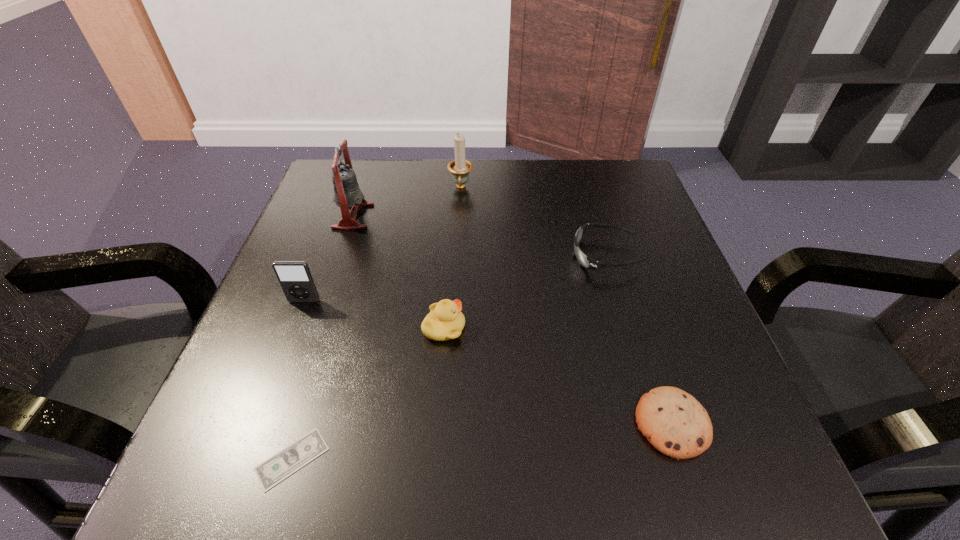
This screenshot has height=540, width=960. I want to click on the tallest object, so [x=347, y=193].

Identify the location of bell. (347, 193).

Locate an element on the screen. Image resolution: width=960 pixels, height=540 pixels. the farthest object is located at coordinates (460, 168).

In order to click on candle_holder in this screenshot , I will do `click(460, 168)`.

Identify the location of iPod. (296, 281).

This screenshot has height=540, width=960. Find the location of `the third tallest object`. the third tallest object is located at coordinates (296, 281).

Image resolution: width=960 pixels, height=540 pixels. Find the location of `duckling`. duckling is located at coordinates (445, 321).

Where is `the fifth farthest object`? the fifth farthest object is located at coordinates (445, 321).

Where is `sunglasses`? The image size is (960, 540). sunglasses is located at coordinates (585, 261).

The image size is (960, 540). What are the coordinates of `the third farthest object` in the screenshot? It's located at (585, 261).